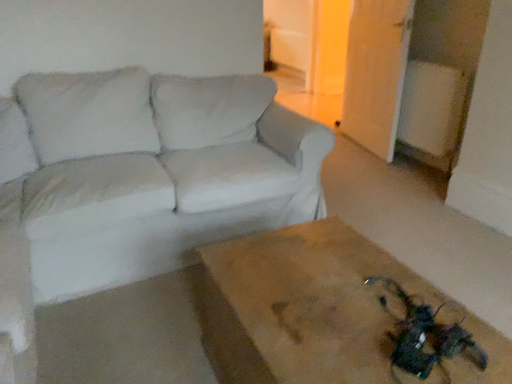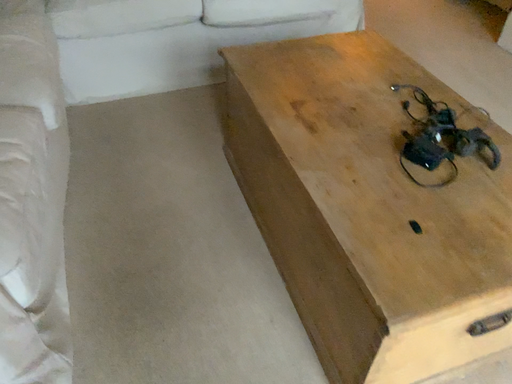
Question: How did the camera likely rotate when shooting the video?

Choices:
 (A) rotated downward
 (B) rotated upward

Answer: (A)